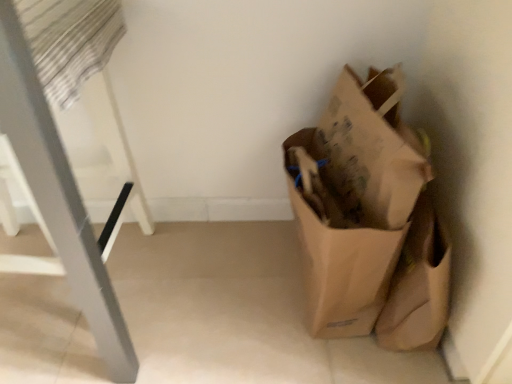
Question: Can you confirm if metallic silver ladder at left is wider than brown paper bag at right?

Choices:
 (A) no
 (B) yes

Answer: (B)

Question: Can you confirm if metallic silver ladder at left is taller than brown paper bag at right?

Choices:
 (A) no
 (B) yes

Answer: (B)

Question: Is metallic silver ladder at left shorter than brown paper bag at right?

Choices:
 (A) no
 (B) yes

Answer: (A)

Question: Can you confirm if metallic silver ladder at left is bigger than brown paper bag at right?

Choices:
 (A) yes
 (B) no

Answer: (A)

Question: Is metallic silver ladder at left behind brown paper bag at right?

Choices:
 (A) yes
 (B) no

Answer: (B)

Question: Is metallic silver ladder at left thinner than brown paper bag at right?

Choices:
 (A) no
 (B) yes

Answer: (A)

Question: From the image's perspective, is brown paper bag at right above metallic silver ladder at left?

Choices:
 (A) no
 (B) yes

Answer: (A)

Question: Does brown paper bag at right have a greater height compared to metallic silver ladder at left?

Choices:
 (A) yes
 (B) no

Answer: (B)

Question: Is brown paper bag at right outside metallic silver ladder at left?

Choices:
 (A) no
 (B) yes

Answer: (B)

Question: From the image's perspective, is brown paper bag at right under metallic silver ladder at left?

Choices:
 (A) yes
 (B) no

Answer: (A)

Question: Does brown paper bag at right have a greater width compared to metallic silver ladder at left?

Choices:
 (A) no
 (B) yes

Answer: (A)

Question: Is brown paper bag at right shorter than metallic silver ladder at left?

Choices:
 (A) no
 (B) yes

Answer: (B)

Question: Considering the positions of brown paper bag at right and metallic silver ladder at left in the image, is brown paper bag at right wider or thinner than metallic silver ladder at left?

Choices:
 (A) thin
 (B) wide

Answer: (A)